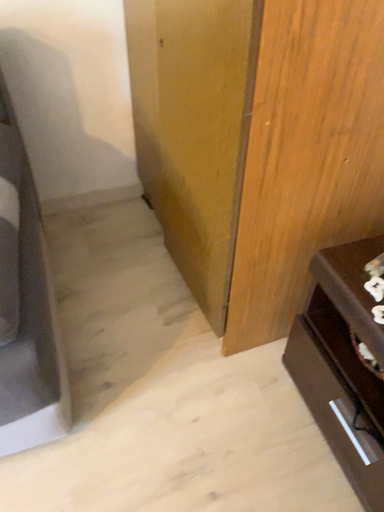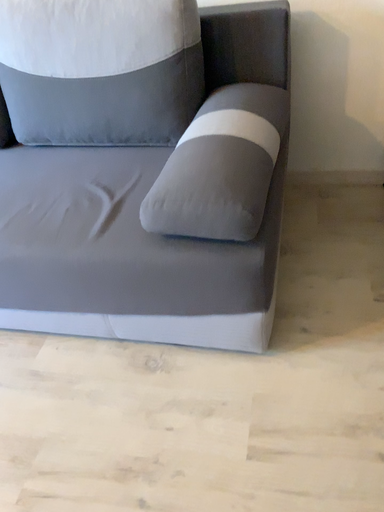
Question: How did the camera likely rotate when shooting the video?

Choices:
 (A) rotated downward
 (B) rotated upward

Answer: (B)